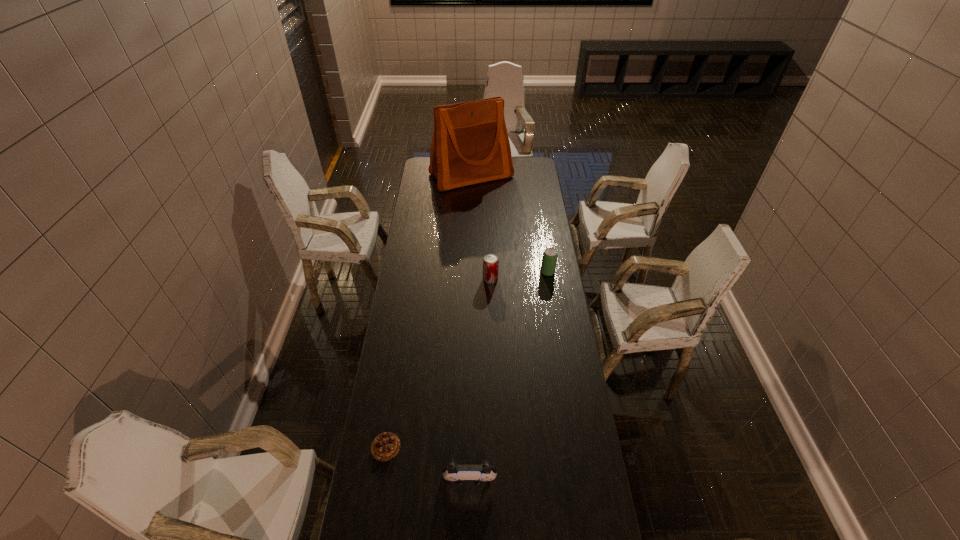
Where is `blank space located 0.080m on the front-facing side of the nearest object`? The width and height of the screenshot is (960, 540). blank space located 0.080m on the front-facing side of the nearest object is located at coordinates click(x=469, y=520).

At what (x,y) coordinates should I click in order to perform the action: click on vacant space located 0.130m on the front of the chocolate cake. Please return your answer as a coordinate pair (x, y). The image size is (960, 540). Looking at the image, I should click on (376, 503).

Identify the location of object that is at the far edge. This screenshot has width=960, height=540. (470, 145).

Identify the location of shopping bag located in the left edge section of the desktop. The height and width of the screenshot is (540, 960). (470, 145).

This screenshot has height=540, width=960. What are the coordinates of `chocolate cake at the left edge` in the screenshot? It's located at (385, 446).

At what (x,y) coordinates should I click in order to perform the action: click on object positioned at the right edge. Please return your answer as a coordinate pair (x, y). This screenshot has width=960, height=540. Looking at the image, I should click on (549, 259).

You are a GUI agent. You are given a task and a screenshot of the screen. Output one action in this format:
    pyautogui.click(x=<x>, y=<y>)
    Task: Click on the object positioned at the far left corner
    Image resolution: width=960 pixels, height=540 pixels.
    Given the screenshot: What is the action you would take?
    pyautogui.click(x=470, y=145)

In the image, there is a desktop. What are the coordinates of `vacant space at the left edge` in the screenshot? It's located at (421, 335).

In the image, there is a desktop. Where is `vacant space at the right edge`? This screenshot has height=540, width=960. vacant space at the right edge is located at coordinates (537, 326).

The height and width of the screenshot is (540, 960). In order to click on vacant space at the far right corner of the desktop in this screenshot , I will do `click(517, 162)`.